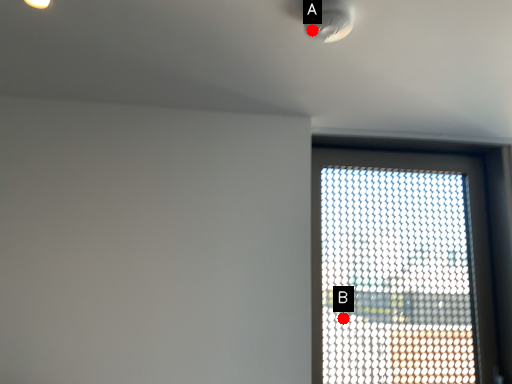
Question: Two points are circled on the image, labeled by A and B beside each circle. Which point is closer to the camera?

Choices:
 (A) A is closer
 (B) B is closer

Answer: (A)